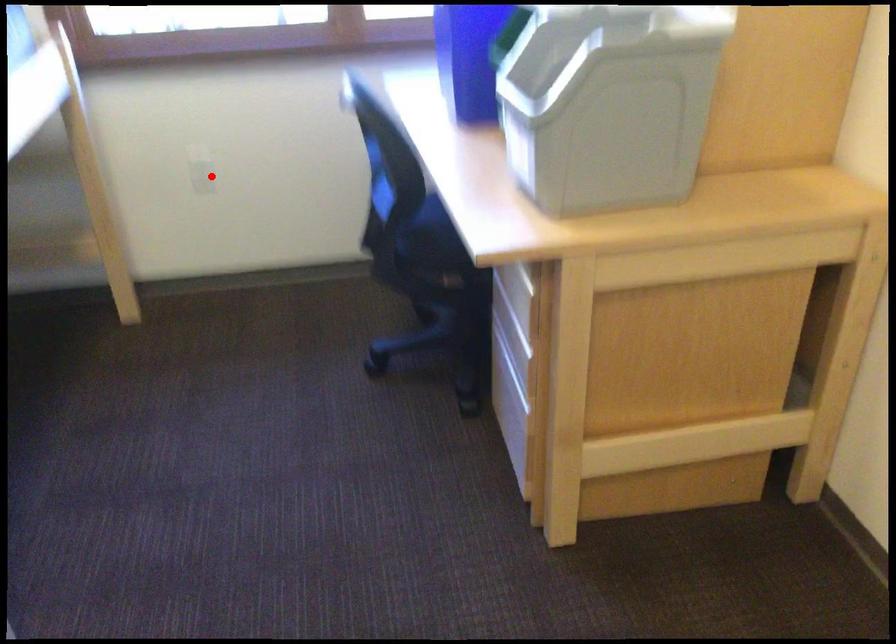
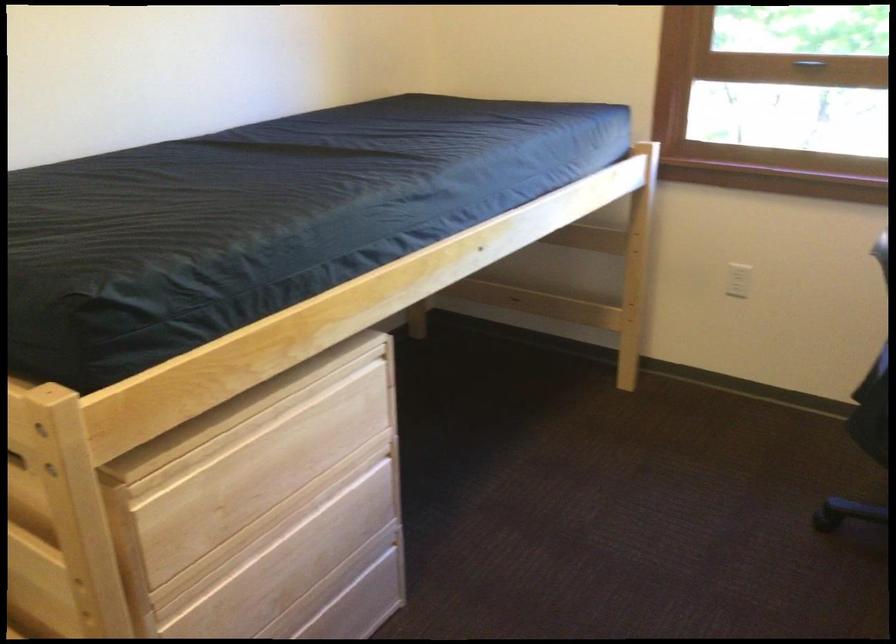
In the second image, find the point that corresponds to the highlighted location in the first image.

(738, 279)